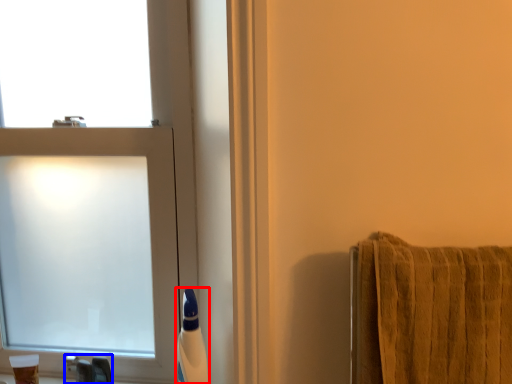
Question: Which object is further to the camera taking this photo, toiletry (highlighted by a red box) or faucet (highlighted by a blue box)?

Choices:
 (A) toiletry
 (B) faucet

Answer: (B)